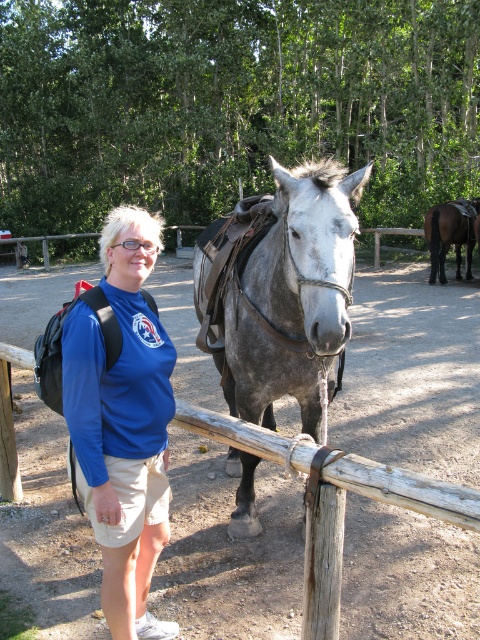
Is blue fabric shirt at center further to camera compared to shiny dark brown horse at center?

That is False.

Which is below, blue fabric shirt at center or shiny dark brown horse at center?

Positioned lower is blue fabric shirt at center.

This screenshot has width=480, height=640. I want to click on blue fabric shirt at center, so click(x=122, y=422).

Can you confirm if blue fabric shirt at center is thinner than wooden post at center?

Yes, blue fabric shirt at center is thinner than wooden post at center.

Can you confirm if blue fabric shirt at center is taller than wooden post at center?

Yes.

Who is more distant from viewer, (129, 305) or (32, 353)?

The point (32, 353) is behind.

The image size is (480, 640). I want to click on blue fabric shirt at center, so click(122, 422).

Between wooden post at center and shiny dark brown horse at center, which one has less height?

wooden post at center is shorter.

Does point (320, 572) come in front of point (444, 220)?

Yes, point (320, 572) is closer to viewer.

Find the location of a particular element. wooden post at center is located at coordinates (389, 499).